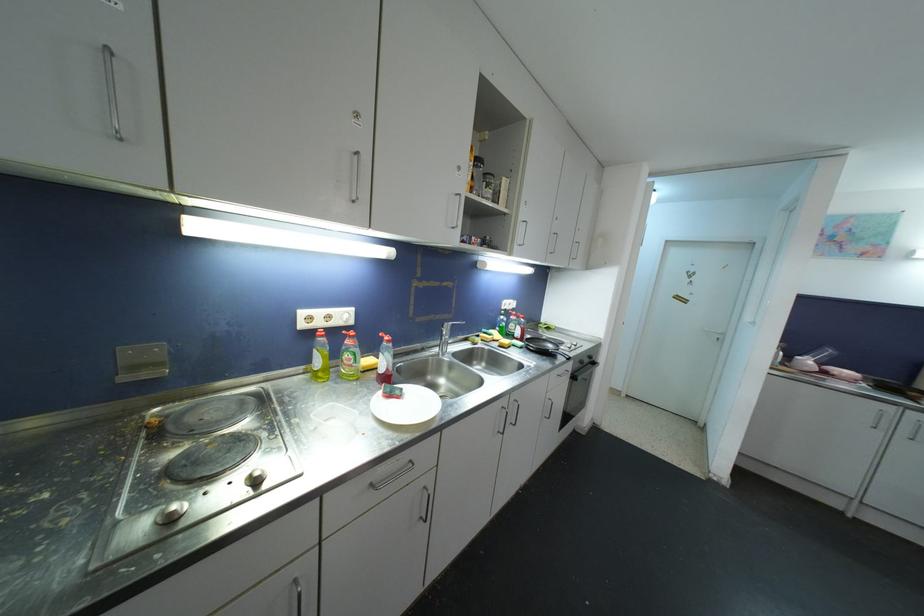
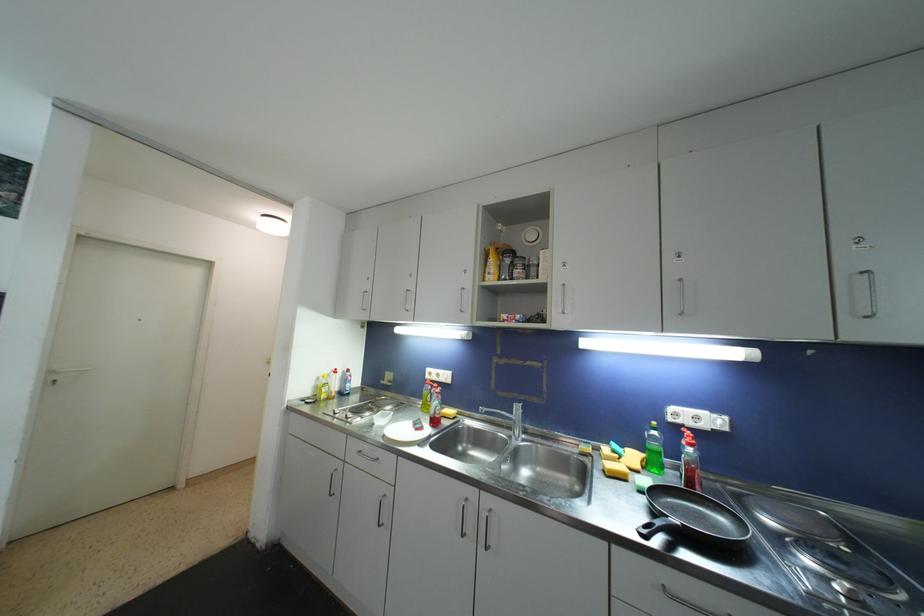
Locate, in the second image, the point that corresponds to point 332,320 in the first image.

(441, 378)